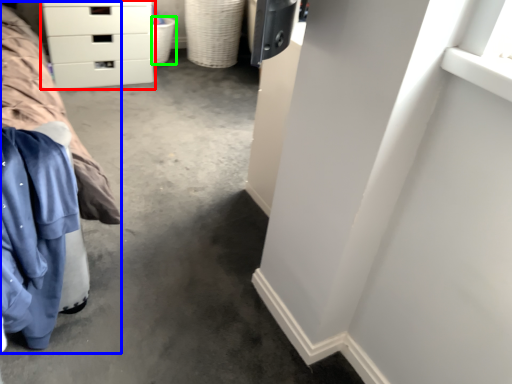
Question: Based on their relative distances, which object is farther from chest of drawers (highlighted by a red box)? Choose from bed (highlighted by a blue box) and basket (highlighted by a green box).

Choices:
 (A) bed
 (B) basket

Answer: (A)